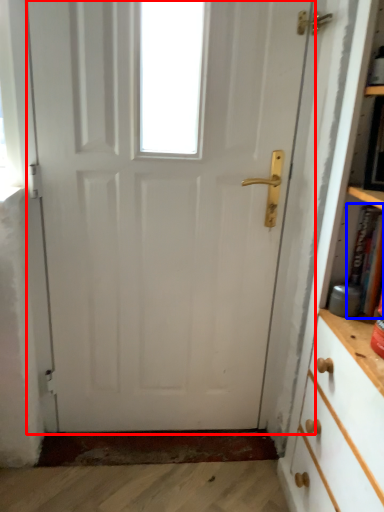
Question: Which object is further to the camera taking this photo, door (highlighted by a red box) or book (highlighted by a blue box)?

Choices:
 (A) door
 (B) book

Answer: (A)